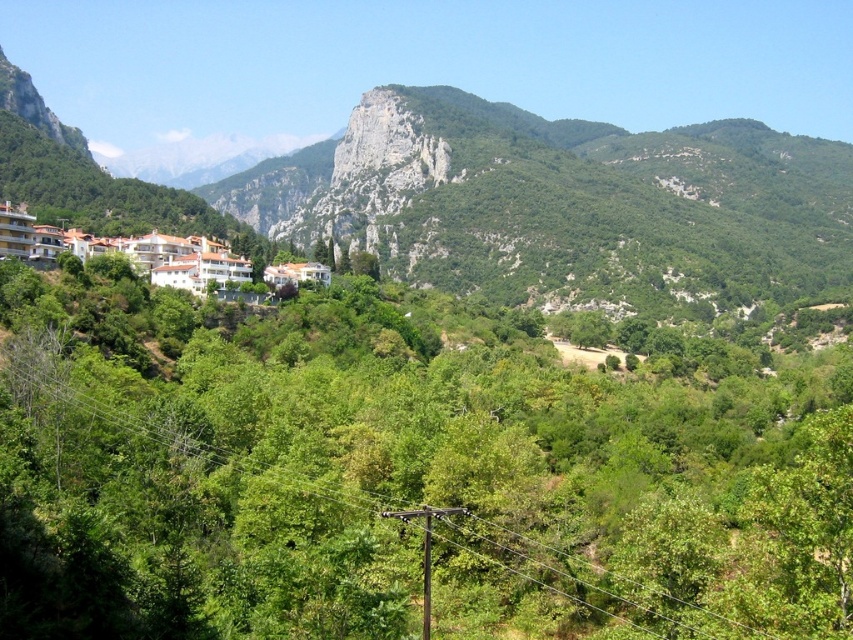
Question: Can you confirm if green rocky mountain at upper center is positioned to the right of white glossy buildings at lower left?

Choices:
 (A) no
 (B) yes

Answer: (B)

Question: Among these objects, which one is farthest from the camera?

Choices:
 (A) green rocky mountain at upper center
 (B) white glossy buildings at lower left

Answer: (A)

Question: Which object is positioned farthest from the green rocky mountain at upper center?

Choices:
 (A) white glossy buildings at lower left
 (B) green leafy tree at upper center

Answer: (A)

Question: Where is green leafy tree at upper center located in relation to white glossy buildings at lower left in the image?

Choices:
 (A) right
 (B) left

Answer: (A)

Question: Is green rocky mountain at upper center to the right of white glossy buildings at lower left from the viewer's perspective?

Choices:
 (A) no
 (B) yes

Answer: (B)

Question: Which object appears farthest from the camera in this image?

Choices:
 (A) white glossy buildings at lower left
 (B) green leafy tree at upper center
 (C) green rocky mountain at upper center

Answer: (C)